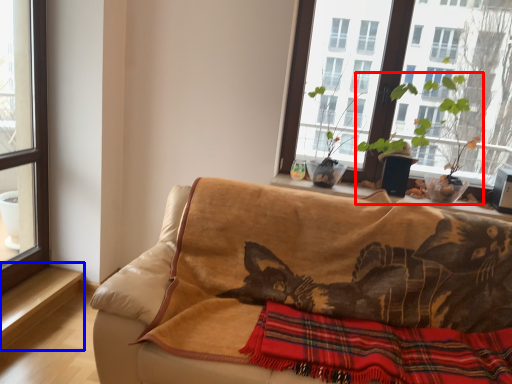
Question: Which of the following is the farthest to the observer, houseplant (highlighted by a red box) or window sill (highlighted by a blue box)?

Choices:
 (A) houseplant
 (B) window sill

Answer: (B)